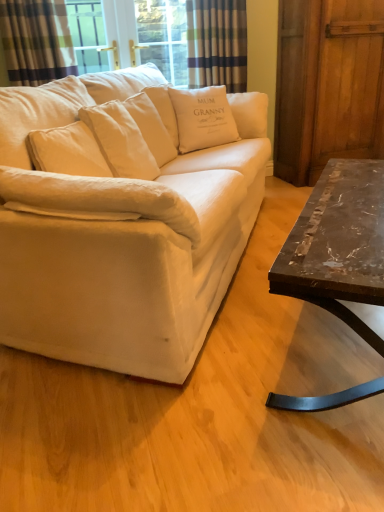
Question: Could you tell me if wooden barn door at right is facing marble/black metal coffee table at right?

Choices:
 (A) no
 (B) yes

Answer: (A)

Question: Does wooden barn door at right have a greater height compared to marble/black metal coffee table at right?

Choices:
 (A) yes
 (B) no

Answer: (A)

Question: Can you see wooden barn door at right touching marble/black metal coffee table at right?

Choices:
 (A) no
 (B) yes

Answer: (A)

Question: From the image's perspective, is wooden barn door at right beneath marble/black metal coffee table at right?

Choices:
 (A) no
 (B) yes

Answer: (A)

Question: Considering the relative positions of wooden barn door at right and marble/black metal coffee table at right in the image provided, is wooden barn door at right to the left of marble/black metal coffee table at right from the viewer's perspective?

Choices:
 (A) no
 (B) yes

Answer: (A)

Question: In terms of height, does white cotton couch at center look taller or shorter compared to marble/black metal coffee table at right?

Choices:
 (A) short
 (B) tall

Answer: (B)

Question: Considering the positions of white cotton couch at center and marble/black metal coffee table at right in the image, is white cotton couch at center wider or thinner than marble/black metal coffee table at right?

Choices:
 (A) thin
 (B) wide

Answer: (B)

Question: Considering their positions, is white cotton couch at center located in front of or behind marble/black metal coffee table at right?

Choices:
 (A) front
 (B) behind

Answer: (A)

Question: Is point (86, 288) closer or farther from the camera than point (354, 273)?

Choices:
 (A) closer
 (B) farther

Answer: (B)

Question: Considering the positions of white cotton cushion at center, which is the 2th pillow from left to right, and white cotton cushion at center, arranged as the second pillow when viewed from the right, in the image, is white cotton cushion at center, which is the 2th pillow from left to right, wider or thinner than white cotton cushion at center, arranged as the second pillow when viewed from the right,?

Choices:
 (A) wide
 (B) thin

Answer: (A)

Question: From the image's perspective, relative to white cotton cushion at center, arranged as the second pillow when viewed from the right, is white cotton cushion at center, which is the 2th pillow from left to right, above or below?

Choices:
 (A) above
 (B) below

Answer: (A)

Question: From a real-world perspective, is white cotton cushion at center, which is the 2th pillow from left to right, physically located above or below white cotton cushion at center, the 1th pillow positioned from the left?

Choices:
 (A) below
 (B) above

Answer: (A)

Question: Visually, is white cotton cushion at center, which is the 2th pillow from left to right, positioned to the left or to the right of white cotton cushion at center, the 1th pillow positioned from the left?

Choices:
 (A) right
 (B) left

Answer: (A)

Question: Looking at their shapes, would you say plaid fabric curtain at upper center, the second curtain from the left, is wider or thinner than marble/black metal coffee table at right?

Choices:
 (A) wide
 (B) thin

Answer: (B)

Question: Visually, is plaid fabric curtain at upper center, marked as the second curtain in a front-to-back arrangement, positioned to the left or to the right of marble/black metal coffee table at right?

Choices:
 (A) left
 (B) right

Answer: (A)